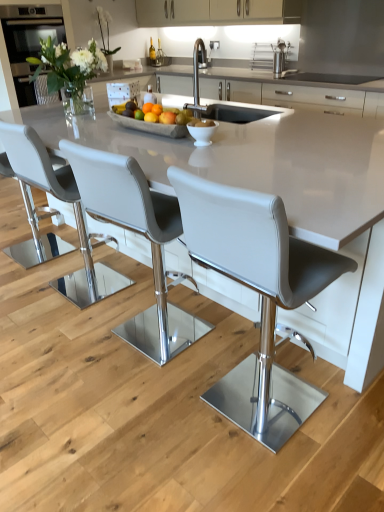
This screenshot has width=384, height=512. What are the coordinates of `vacant area to the right of matte gray chair at center, which is the 1th chair in right-to-left order` in the screenshot? It's located at (343, 413).